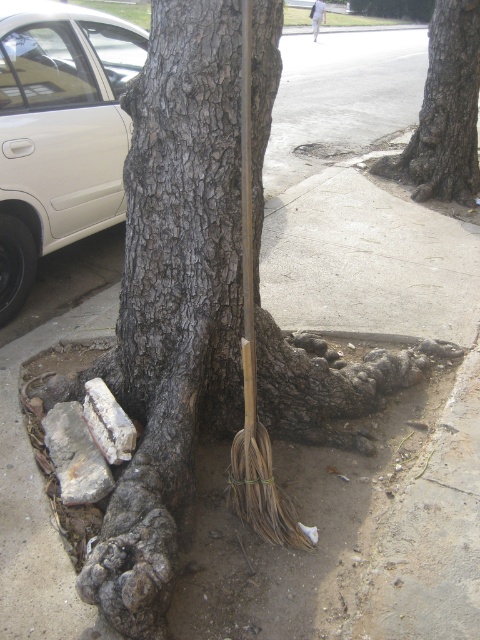
You are a pedestrian standing on the sidewalk and see the white matte car at left and the white fabric at upper center in the scene. Which object is positioned higher relative to the other?

The white fabric at upper center is positioned higher than the white matte car at left.

You are a delivery driver who needs to park your white matte car at left at point (60,131). However, there is a tree with thick trunk and extensive root system in the way. Can you park your car there without damaging the tree?

The white matte car at left is located at point (60,131), which is near the tree with thick trunk and extensive root system. The exposed roots may obstruct parking space, so there is a risk of damaging the roots if you park there.

You are a delivery person who needs to park your white matte car at left near the rough bark tree at upper right. However, there is a height restriction of 2 meters for parking. Can your car fit under the tree without hitting its branches?

The white matte car at left is much taller than the rough bark tree at upper right. Since the tree is shorter than the car, the car might hit the branches when parking under it. Therefore, it is not advisable to park there.